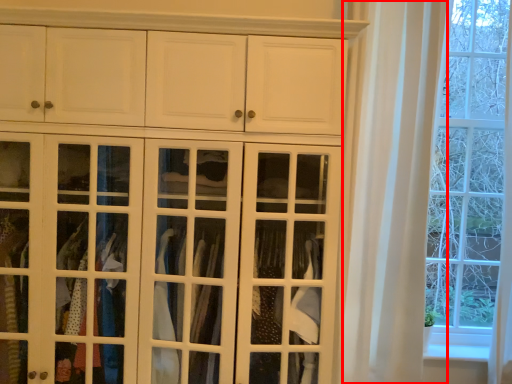
Question: From the image's perspective, what is the correct spatial relationship of curtain (annotated by the red box) in relation to door?

Choices:
 (A) above
 (B) below

Answer: (A)